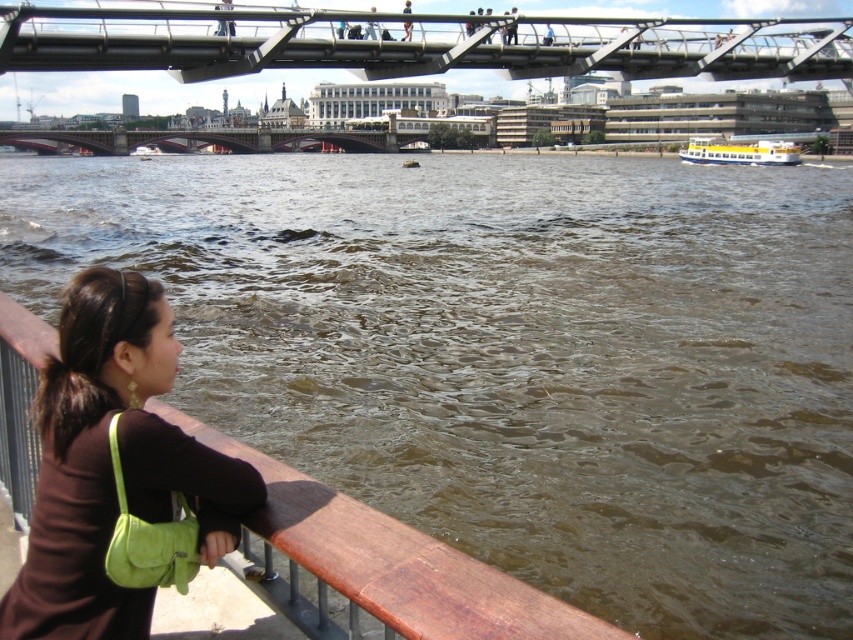
You are standing at the riverbank and want to take a photo of the dark red stone bridge at center without the green suede shoulder bag at lower left appearing in the frame. How should you adjust your position?

Move your position so that the dark red stone bridge at center is no longer aligned with the green suede shoulder bag at lower left. Since the dark red stone bridge at center is positioned over the green suede shoulder bag at lower left, shifting your viewpoint downward or to the side will exclude the bag from the frame.

You are a photographer trying to capture the person leaning on the wooden railing. You notice the brown suede purse at lower left and the dark brown hair at lower left in your frame. Which object appears taller in the photo?

The brown suede purse at lower left appears taller in the photo because it has a greater height compared to the dark brown hair at lower left.